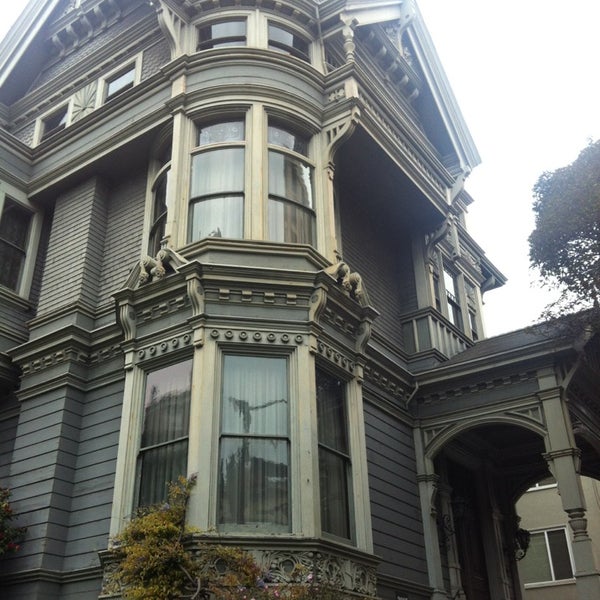
Where is `window`? window is located at coordinates (224, 171).